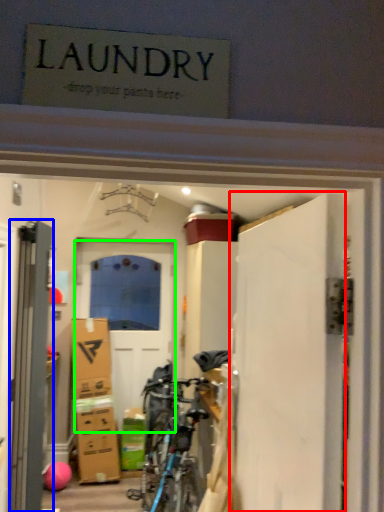
Question: Considering the real-world distances, which object is closest to door (highlighted by a red box)? door (highlighted by a blue box) or door (highlighted by a green box).

Choices:
 (A) door
 (B) door

Answer: (A)